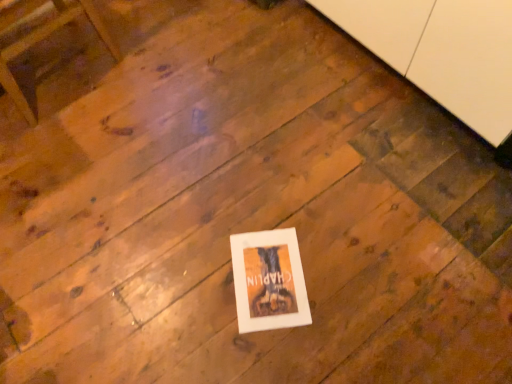
Identify the location of empty space that is ontop of white paper at center (from a real-world perspective). Image resolution: width=512 pixels, height=384 pixels. 264,274.